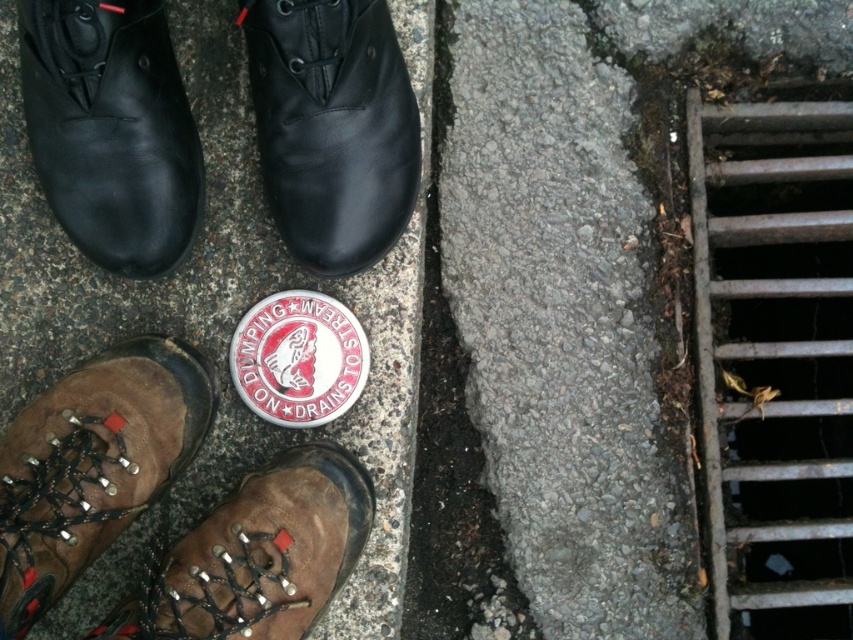
You are trying to determine which object is wider between the brown leather boot at lower left and the brown leather shoe at lower left. Based on the scene, which one has a greater width?

The brown leather shoe at lower left is wider because its width is greater than the brown leather boot at lower left.

You are organizing a shoe rack and need to place the brown leather boot at lower left and the brown leather shoe at lower left. Which one requires more space due to its size?

The brown leather boot at lower left requires more space because it is bigger than the brown leather shoe at lower left.